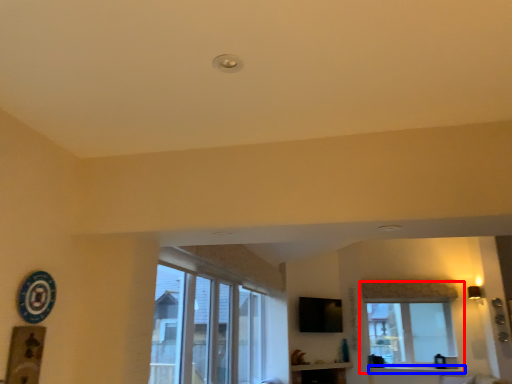
Question: Which object appears farthest to the camera in this image, window (highlighted by a red box) or window sill (highlighted by a blue box)?

Choices:
 (A) window
 (B) window sill

Answer: (A)